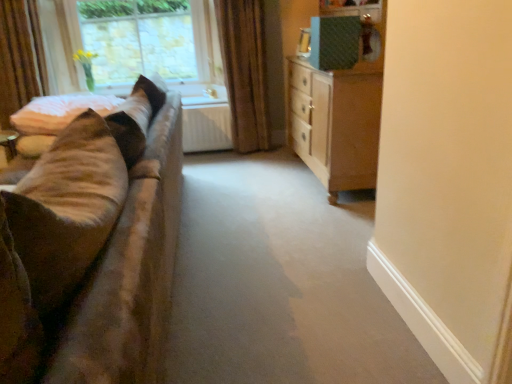
Question: Is soft beige fabric at left completely or partially inside wooden chest of drawers at right?

Choices:
 (A) no
 (B) yes

Answer: (A)

Question: Is wooden chest of drawers at right positioned behind soft beige fabric at left?

Choices:
 (A) no
 (B) yes

Answer: (A)

Question: Is wooden chest of drawers at right facing towards soft beige fabric at left?

Choices:
 (A) no
 (B) yes

Answer: (B)

Question: From the image's perspective, would you say wooden chest of drawers at right is positioned over soft beige fabric at left?

Choices:
 (A) no
 (B) yes

Answer: (B)

Question: Is the position of wooden chest of drawers at right less distant than that of soft beige fabric at left?

Choices:
 (A) yes
 (B) no

Answer: (A)

Question: Is wooden chest of drawers at right to the left of soft beige fabric at left from the viewer's perspective?

Choices:
 (A) yes
 (B) no

Answer: (B)

Question: Can you confirm if brown fabric curtain at upper center is wider than velvet brown couch at left?

Choices:
 (A) yes
 (B) no

Answer: (B)

Question: Is brown fabric curtain at upper center far from velvet brown couch at left?

Choices:
 (A) no
 (B) yes

Answer: (B)

Question: Does brown fabric curtain at upper center come behind velvet brown couch at left?

Choices:
 (A) yes
 (B) no

Answer: (A)

Question: From a real-world perspective, is brown fabric curtain at upper center physically above velvet brown couch at left?

Choices:
 (A) no
 (B) yes

Answer: (B)

Question: From the image's perspective, is brown fabric curtain at upper center on velvet brown couch at left?

Choices:
 (A) no
 (B) yes

Answer: (B)

Question: Considering the relative sizes of brown fabric curtain at upper center and velvet brown couch at left in the image provided, is brown fabric curtain at upper center taller than velvet brown couch at left?

Choices:
 (A) no
 (B) yes

Answer: (B)

Question: Can you confirm if soft beige fabric at left is bigger than brown fabric curtain at upper center?

Choices:
 (A) yes
 (B) no

Answer: (B)